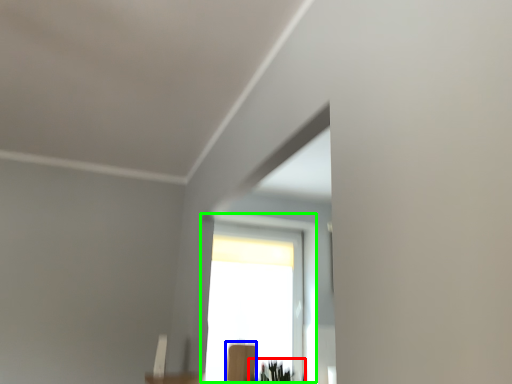
Question: Which is nearer to the plant (highlighted by a red box)? furniture (highlighted by a blue box) or window (highlighted by a green box).

Choices:
 (A) furniture
 (B) window

Answer: (A)